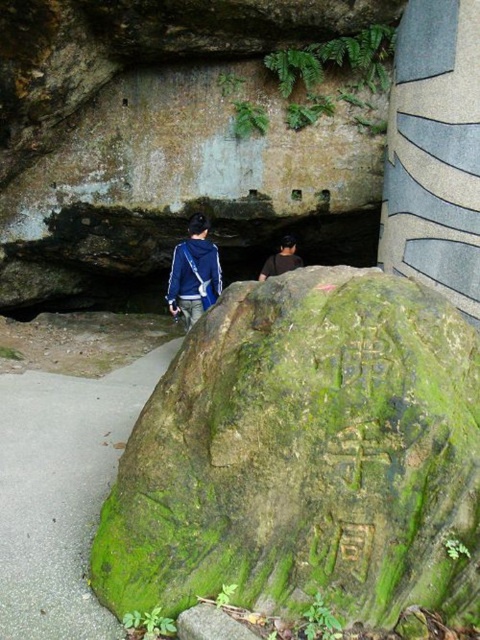
Question: Which object is closer to the camera taking this photo?

Choices:
 (A) green mossy rock at center
 (B) blue fabric jacket at center

Answer: (A)

Question: Is blue fabric jacket at center further to camera compared to dark brown leather jacket at center?

Choices:
 (A) no
 (B) yes

Answer: (A)

Question: Does green mossy rock at center have a greater width compared to blue fabric jacket at center?

Choices:
 (A) yes
 (B) no

Answer: (A)

Question: Is green mossy rock at center below dark brown leather jacket at center?

Choices:
 (A) yes
 (B) no

Answer: (A)

Question: Among these objects, which one is farthest from the camera?

Choices:
 (A) blue fabric jacket at center
 (B) dark brown leather jacket at center
 (C) green mossy rock at center

Answer: (B)

Question: Which object is the farthest from the blue fabric jacket at center?

Choices:
 (A) dark brown leather jacket at center
 (B) green mossy rock at center

Answer: (B)